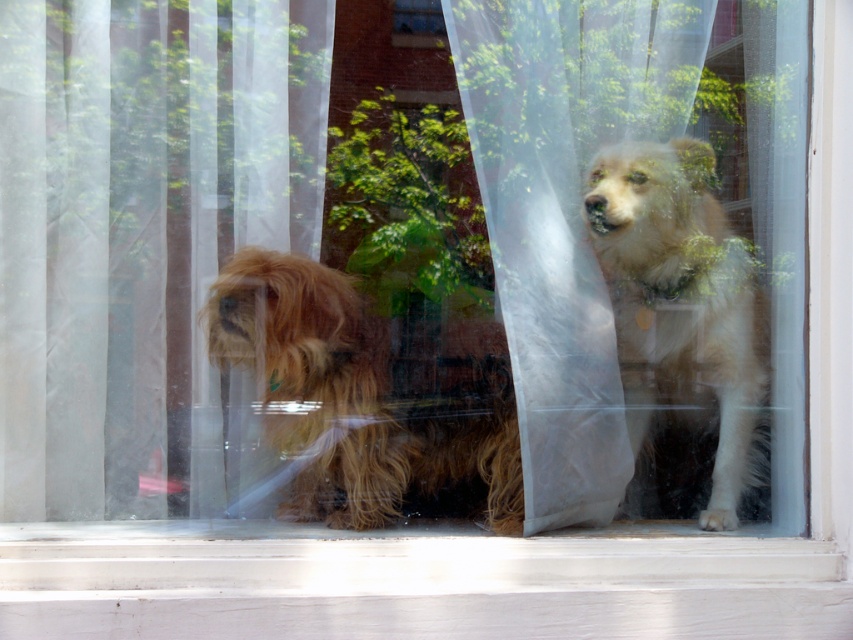
Question: Which point is closer to the camera?

Choices:
 (A) fuzzy brown dog at left
 (B) translucent white curtain at left
 (C) transparent plastic window at center

Answer: (A)

Question: Which is nearer to the transparent plastic window at center?

Choices:
 (A) fuzzy brown dog at left
 (B) translucent white curtain at left

Answer: (B)

Question: Is fuzzy brown dog at left to the right of transparent plastic window at center from the viewer's perspective?

Choices:
 (A) no
 (B) yes

Answer: (A)

Question: Is translucent white curtain at left above transparent plastic window at center?

Choices:
 (A) yes
 (B) no

Answer: (B)

Question: Does translucent white curtain at left have a smaller size compared to fuzzy brown dog at left?

Choices:
 (A) no
 (B) yes

Answer: (A)

Question: Which object is the closest to the transparent plastic window at center?

Choices:
 (A) fuzzy brown dog at left
 (B) translucent white curtain at left

Answer: (B)